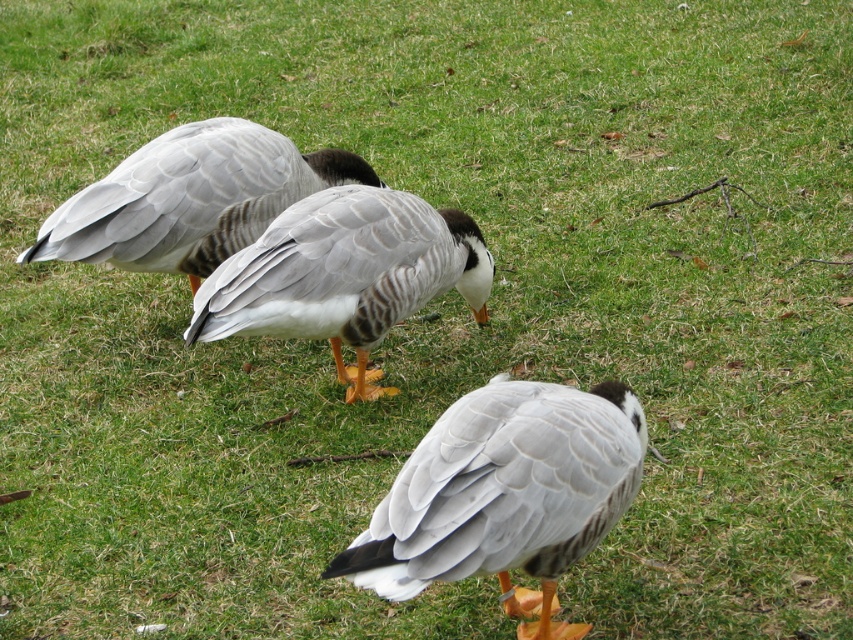
You are a birdwatcher observing the three Bar headed geese and two ducks in the scene. You notice the white feathered duck at center and the gray matte duck at upper left. Which duck is located more to the right side?

The white feathered duck at center is positioned on the right side of gray matte duck at upper left, so it is more to the right.

You are a birdwatcher observing the three Barheaded geese and two ducks in the scene. You notice the white feathered duck at center and the gray matte duck at upper left. Which duck is positioned lower in the image?

The white feathered duck at center is positioned lower than the gray matte duck at upper left.